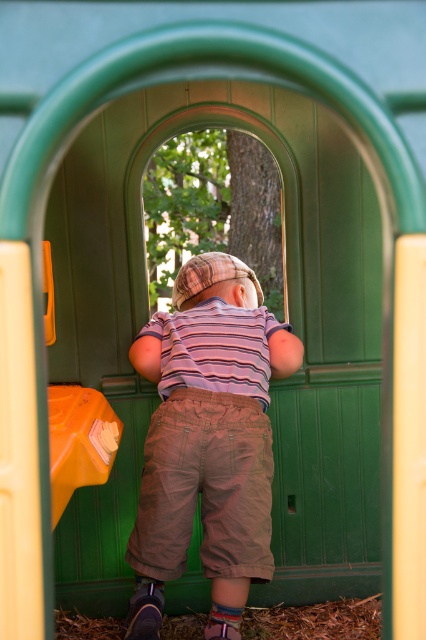
Which is below, striped cotton shirt at center or orange plastic slide at left?

orange plastic slide at left is below.

Identify the location of striped cotton shirt at center. The width and height of the screenshot is (426, 640). (207, 440).

Can you confirm if green matte door at center is taller than orange plastic slide at left?

Yes, green matte door at center is taller than orange plastic slide at left.

Does green matte door at center appear on the left side of orange plastic slide at left?

In fact, green matte door at center is to the right of orange plastic slide at left.

What do you see at coordinates (288, 317) in the screenshot?
I see `green matte door at center` at bounding box center [288, 317].

The height and width of the screenshot is (640, 426). Identify the location of green matte door at center. (288, 317).

Is green matte door at center taller than striped cotton shirt at center?

Indeed, green matte door at center has a greater height compared to striped cotton shirt at center.

Measure the distance between green matte door at center and camera.

green matte door at center is 3.74 meters away from camera.

The height and width of the screenshot is (640, 426). Describe the element at coordinates (288, 317) in the screenshot. I see `green matte door at center` at that location.

At what (x,y) coordinates should I click in order to perform the action: click on green matte door at center. Please return your answer as a coordinate pair (x, y). Looking at the image, I should click on (288, 317).